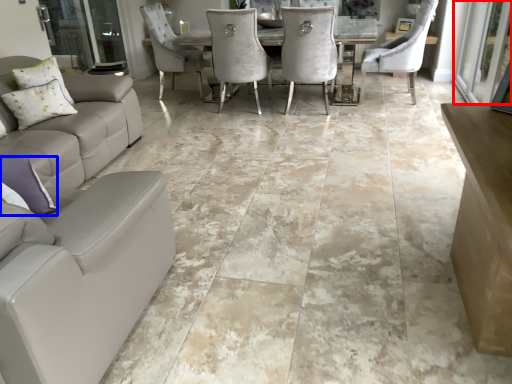
Question: Which object appears closest to the camera in this image, screen door (highlighted by a red box) or pillow (highlighted by a blue box)?

Choices:
 (A) screen door
 (B) pillow

Answer: (B)